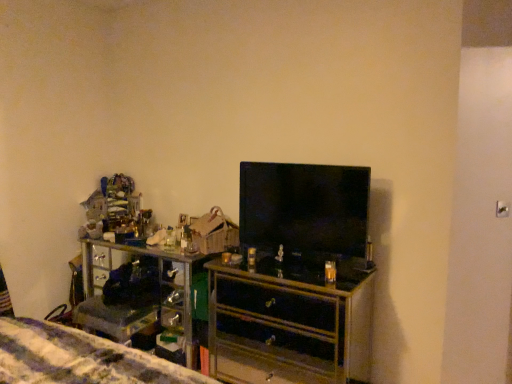
Question: Is point (290, 266) closer or farther from the camera than point (303, 170)?

Choices:
 (A) closer
 (B) farther

Answer: (A)

Question: Is black glossy chest of drawers at center wider or thinner than black glossy tv at center?

Choices:
 (A) wide
 (B) thin

Answer: (A)

Question: In terms of height, does black glossy chest of drawers at center look taller or shorter compared to black glossy tv at center?

Choices:
 (A) tall
 (B) short

Answer: (A)

Question: Is point (266, 203) closer or farther from the camera than point (276, 329)?

Choices:
 (A) farther
 (B) closer

Answer: (B)

Question: Based on their sizes in the image, would you say black glossy tv at center is bigger or smaller than black glossy chest of drawers at center?

Choices:
 (A) big
 (B) small

Answer: (B)

Question: From their relative heights in the image, would you say black glossy tv at center is taller or shorter than black glossy chest of drawers at center?

Choices:
 (A) short
 (B) tall

Answer: (A)

Question: In the image, is black glossy tv at center on the left side or the right side of black glossy chest of drawers at center?

Choices:
 (A) right
 (B) left

Answer: (A)